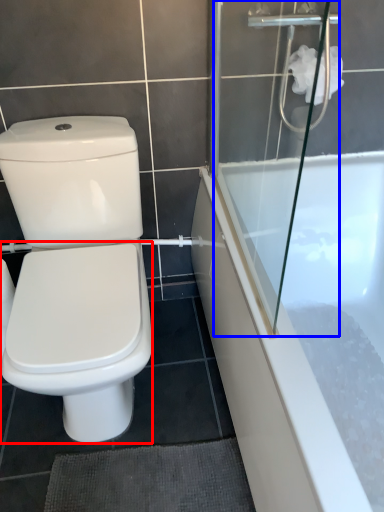
Question: Which point is closer to the camera, bidet (highlighted by a red box) or shower door (highlighted by a blue box)?

Choices:
 (A) bidet
 (B) shower door

Answer: (B)